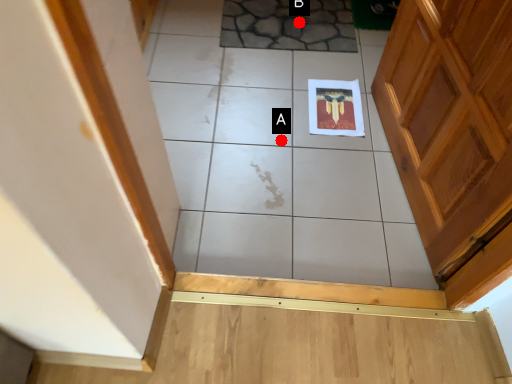
Question: Two points are circled on the image, labeled by A and B beside each circle. Which of the following is the closest to the observer?

Choices:
 (A) A is closer
 (B) B is closer

Answer: (A)